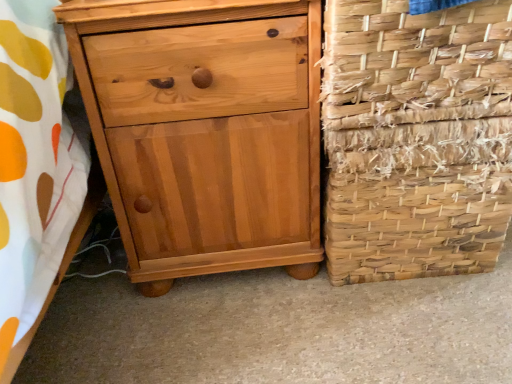
Where is `vacant area that is in front of woven natural fiber basket at right`? This screenshot has height=384, width=512. vacant area that is in front of woven natural fiber basket at right is located at coordinates (406, 328).